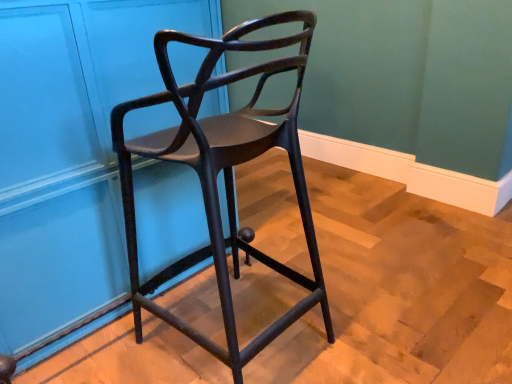
What do you see at coordinates (70, 149) in the screenshot?
I see `matte blue door at upper left` at bounding box center [70, 149].

In order to face matte blue door at upper left, should I rotate leftwards or rightwards?

Turn left approximately 19.593 degrees to face it.

What are the coordinates of `matte blue door at upper left` in the screenshot? It's located at (70, 149).

What is the approximate width of matte blue door at upper left?

matte blue door at upper left is 26.23 inches in width.

In order to face matte black chair at center, should I rotate leftwards or rightwards?

It's best to rotate left around 4.550 degrees.

Find the location of a particular element. matte black chair at center is located at coordinates (224, 174).

What do you see at coordinates (224, 174) in the screenshot?
I see `matte black chair at center` at bounding box center [224, 174].

Find the location of a particular element. The width and height of the screenshot is (512, 384). matte blue door at upper left is located at coordinates (70, 149).

Considering the positions of objects matte blue door at upper left and matte black chair at center in the image provided, who is more to the left, matte blue door at upper left or matte black chair at center?

Positioned to the left is matte blue door at upper left.

Which object is closer to the camera taking this photo, matte blue door at upper left or matte black chair at center?

matte black chair at center is closer to the camera.

Between point (70, 218) and point (271, 265), which one is positioned behind?

The point (271, 265) is farther.

From the image's perspective, is matte blue door at upper left below matte black chair at center?

Actually, matte blue door at upper left appears above matte black chair at center in the image.

From a real-world perspective, who is located lower, matte blue door at upper left or matte black chair at center?

matte black chair at center.

Is matte blue door at upper left thinner than matte black chair at center?

Incorrect, the width of matte blue door at upper left is not less than that of matte black chair at center.

Based on the photo, between matte blue door at upper left and matte black chair at center, which one has more height?

With more height is matte blue door at upper left.

Looking at the image, does matte blue door at upper left seem bigger or smaller compared to matte black chair at center?

Clearly, matte blue door at upper left is larger in size than matte black chair at center.

Is matte blue door at upper left located outside matte black chair at center?

matte blue door at upper left is positioned outside matte black chair at center.

Is matte blue door at upper left in contact with matte black chair at center?

There is a gap between matte blue door at upper left and matte black chair at center.

Could you tell me if matte blue door at upper left is turned towards matte black chair at center?

Yes.

Identify the location of door lying above the matte black chair at center (from the image's perspective). (x=70, y=149).

Considering the relative positions of matte black chair at center and matte blue door at upper left in the image provided, is matte black chair at center to the left of matte blue door at upper left from the viewer's perspective?

Incorrect, matte black chair at center is not on the left side of matte blue door at upper left.

Is matte black chair at center closer to camera compared to matte blue door at upper left?

Yes.

Which is in front, point (294, 132) or point (136, 38)?

Point (294, 132)

From the image's perspective, does matte black chair at center appear lower than matte blue door at upper left?

Yes, from the image's perspective, matte black chair at center is below matte blue door at upper left.

From a real-world perspective, is matte black chair at center located higher than matte blue door at upper left?

Actually, matte black chair at center is physically below matte blue door at upper left in the real world.

Is matte black chair at center thinner than matte blue door at upper left?

Indeed, matte black chair at center has a lesser width compared to matte blue door at upper left.

Considering the sizes of objects matte black chair at center and matte blue door at upper left in the image provided, who is taller, matte black chair at center or matte blue door at upper left?

With more height is matte blue door at upper left.

Consider the image. Looking at the image, does matte black chair at center seem bigger or smaller compared to matte blue door at upper left?

Clearly, matte black chair at center is smaller in size than matte blue door at upper left.

Is matte black chair at center inside the boundaries of matte blue door at upper left, or outside?

The correct answer is: outside.

Is matte black chair at center far from matte blue door at upper left?

matte black chair at center is near matte blue door at upper left, not far away.

Is matte black chair at center facing towards matte blue door at upper left?

Yes, matte black chair at center faces towards matte blue door at upper left.

Locate an element on the screen. The image size is (512, 384). door that appears behind the matte black chair at center is located at coordinates (70, 149).

This screenshot has width=512, height=384. I want to click on chair located in front of the matte blue door at upper left, so click(x=224, y=174).

Locate an element on the screen. The width and height of the screenshot is (512, 384). chair below the matte blue door at upper left (from the image's perspective) is located at coordinates (224, 174).